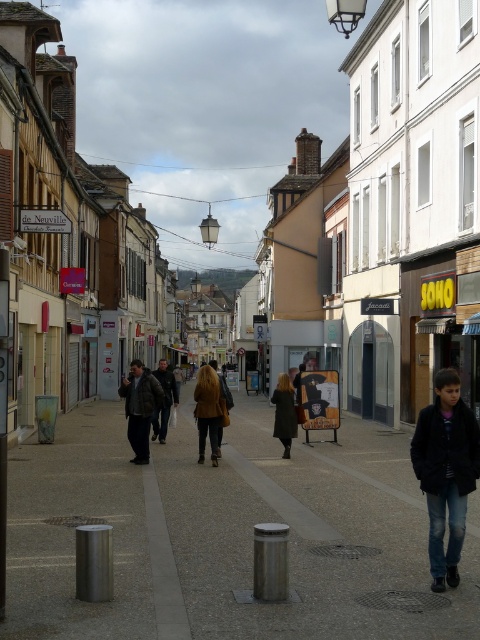
Between leather jacket at center and brown leather coat at center, which one is positioned lower?

brown leather coat at center is below.

The width and height of the screenshot is (480, 640). What do you see at coordinates (140, 406) in the screenshot?
I see `leather jacket at center` at bounding box center [140, 406].

Does point (133, 385) come behind point (217, 392)?

That is True.

The height and width of the screenshot is (640, 480). What are the coordinates of `leather jacket at center` in the screenshot? It's located at (140, 406).

Can you confirm if black matte jacket at lower right is wider than brown leather coat at center?

No, black matte jacket at lower right is not wider than brown leather coat at center.

Identify the location of black matte jacket at lower right. The width and height of the screenshot is (480, 640). (445, 472).

Which is more to the right, matte black sign at center or brown leather jacket at center?

brown leather jacket at center is more to the right.

Is point (62, 368) less distant than point (163, 433)?

No, (62, 368) is further to viewer.

The height and width of the screenshot is (640, 480). Find the location of `matte black sign at center`. matte black sign at center is located at coordinates (274, 230).